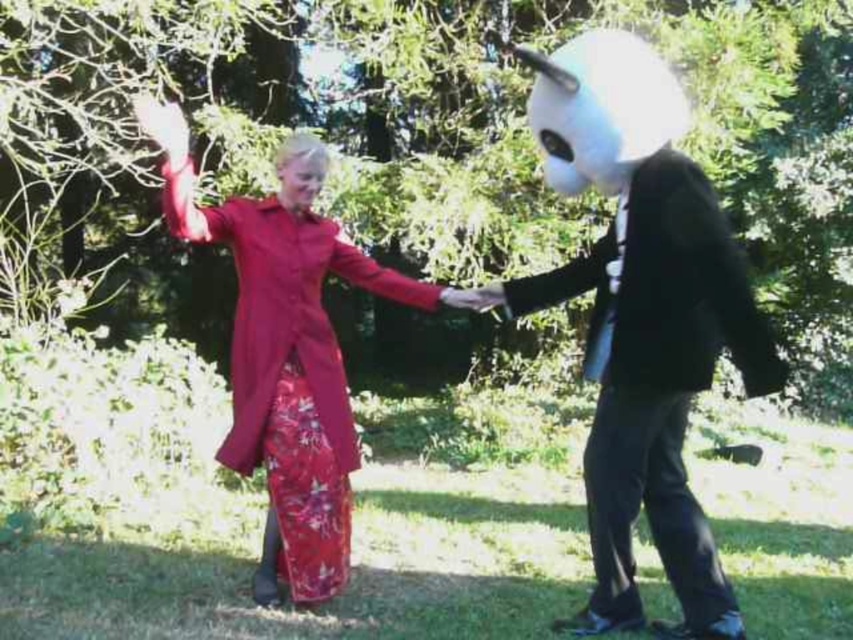
Question: Does white matte mask at right have a smaller size compared to matte red coat at center?

Choices:
 (A) no
 (B) yes

Answer: (B)

Question: Does white matte mask at right have a smaller size compared to matte red coat at center?

Choices:
 (A) no
 (B) yes

Answer: (B)

Question: Which of the following is the closest to the observer?

Choices:
 (A) white matte mask at right
 (B) matte black suit at center
 (C) matte red coat at center

Answer: (B)

Question: Among these objects, which one is farthest from the camera?

Choices:
 (A) white matte mask at right
 (B) matte red coat at center
 (C) matte black suit at center

Answer: (B)

Question: Based on their relative distances, which object is nearer to the matte black suit at center?

Choices:
 (A) white matte mask at right
 (B) matte red coat at center

Answer: (A)

Question: Does matte black suit at center appear under matte red coat at center?

Choices:
 (A) yes
 (B) no

Answer: (A)